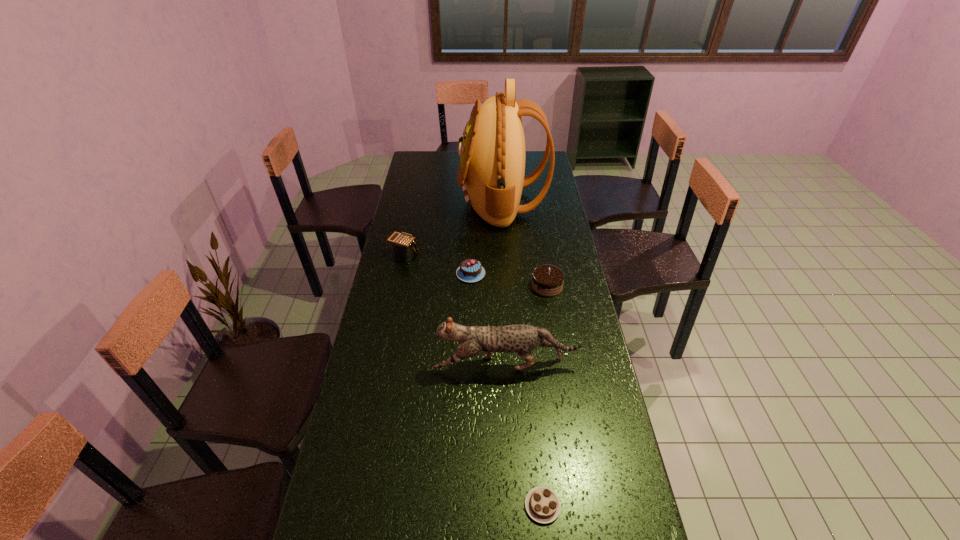
This screenshot has height=540, width=960. Find the location of `free point between the tallest chocolate cake and the second shortest object`. free point between the tallest chocolate cake and the second shortest object is located at coordinates (509, 280).

Where is `blank region between the nearest object and the second farthest object`? Image resolution: width=960 pixels, height=540 pixels. blank region between the nearest object and the second farthest object is located at coordinates (473, 380).

Identify the location of vacant region between the second nearest object and the fifth tallest object. The image size is (960, 540). (489, 319).

Identify the location of free space between the shortest object and the leftmost object. Image resolution: width=960 pixels, height=540 pixels. (473, 380).

Where is `free space between the fifth shortest object and the shortest object`? free space between the fifth shortest object and the shortest object is located at coordinates (524, 435).

Identify which object is located as the fourth nearest to the cat. Please provide its 2D coordinates. Your answer should be formatted as a tuple, i.e. [(x, y)], where the tuple contains the x and y coordinates of a point satisfying the conditions above.

[(403, 245)]

The image size is (960, 540). What are the coordinates of `object that can be found as the second closest to the fifth nearest object` in the screenshot? It's located at (491, 171).

Select which chocolate cake is the second closest to the tallest chocolate cake. Please provide its 2D coordinates. Your answer should be formatted as a tuple, i.e. [(x, y)], where the tuple contains the x and y coordinates of a point satisfying the conditions above.

[(542, 504)]

The height and width of the screenshot is (540, 960). What are the coordinates of `the second closest chocolate cake to the tallest chocolate cake` in the screenshot? It's located at (542, 504).

Find the location of a particular element. This screenshot has width=960, height=540. vacant space that satisfies the following two spatial constraints: 1. on the front-facing side of the backpack; 2. on the front side of the fifth nearest object is located at coordinates (506, 254).